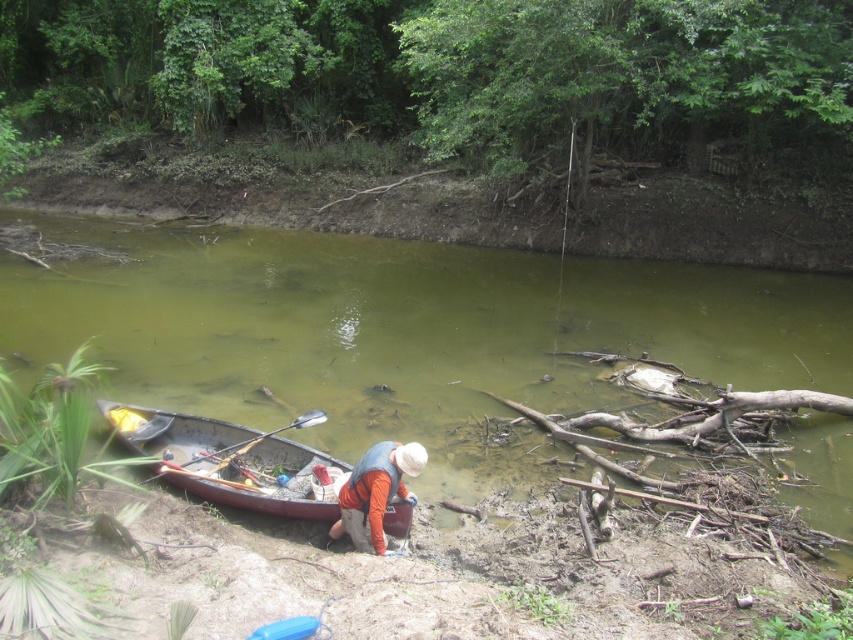
Who is positioned more to the right, green murky water at center or wooden canoe at lower center?

green murky water at center

Is point (511, 368) positioned behind point (389, 509)?

That is True.

Identify the location of green murky water at center. This screenshot has height=640, width=853. (396, 332).

Where is `green murky water at center`? green murky water at center is located at coordinates (396, 332).

Looking at this image, can you confirm if green murky water at center is taller than orange fabric at lower center?

Yes, green murky water at center is taller than orange fabric at lower center.

The height and width of the screenshot is (640, 853). I want to click on green murky water at center, so click(396, 332).

Locate an element on the screen. This screenshot has width=853, height=640. green murky water at center is located at coordinates (396, 332).

Is wooden canoe at lower center positioned before orange fabric at lower center?

No, it is behind orange fabric at lower center.

Can you confirm if wooden canoe at lower center is taller than orange fabric at lower center?

No.

Where is `wooden canoe at lower center`? wooden canoe at lower center is located at coordinates (225, 460).